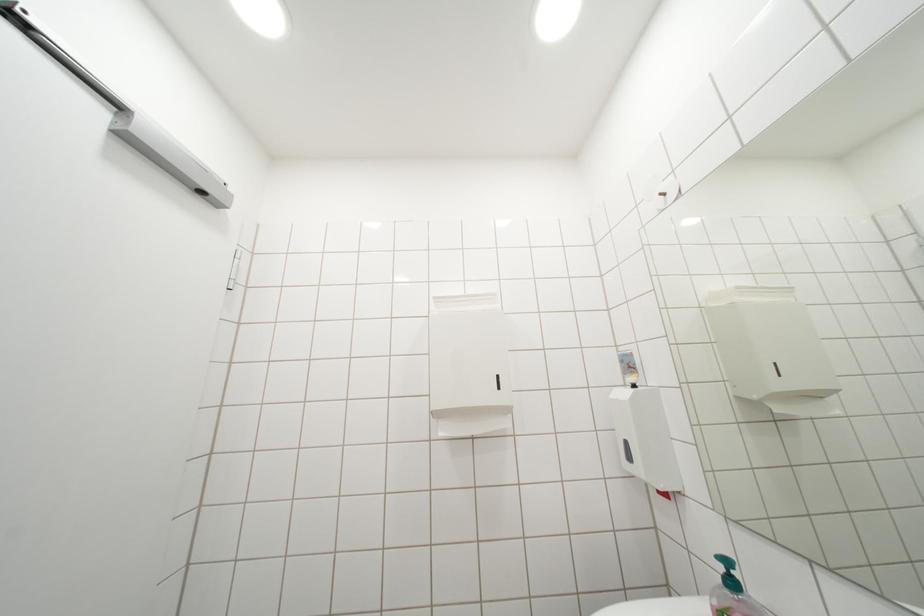
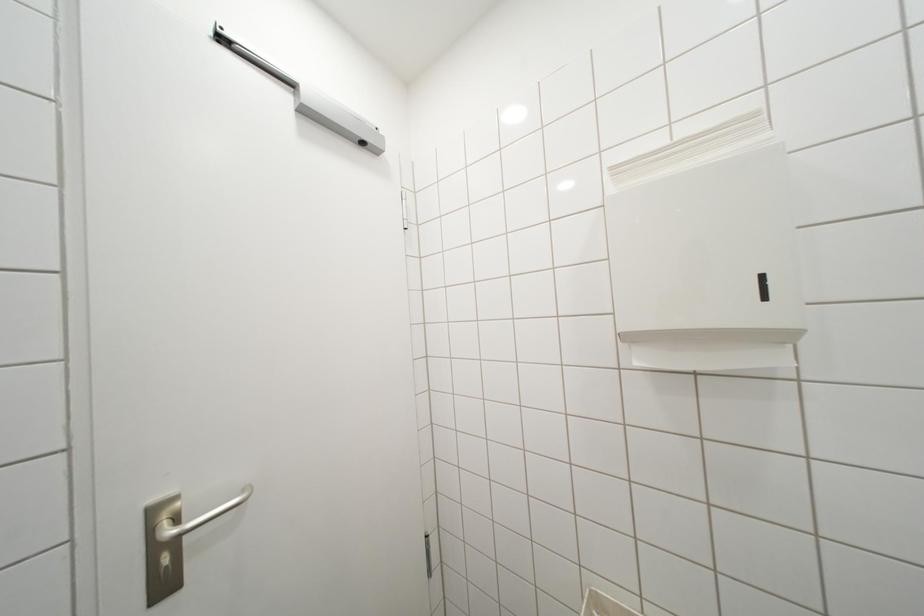
Question: The camera is either moving clockwise (left) or counter-clockwise (right) around the object. The first image is from the beginning of the video and the second image is from the end. Is the camera moving left or right when shooting the video?

Choices:
 (A) Left
 (B) Right

Answer: (B)